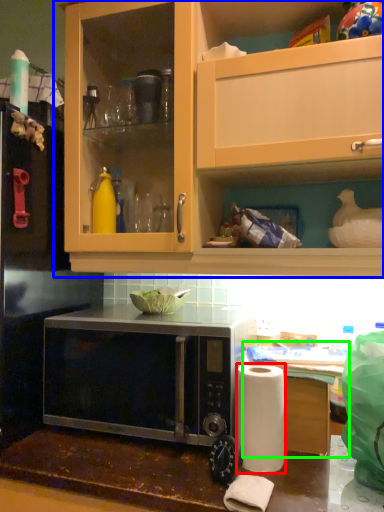
Question: Which object is the farthest from paper towel (highlighted by a red box)? Choose among these: cabinetry (highlighted by a blue box) or table (highlighted by a green box).

Choices:
 (A) cabinetry
 (B) table

Answer: (A)